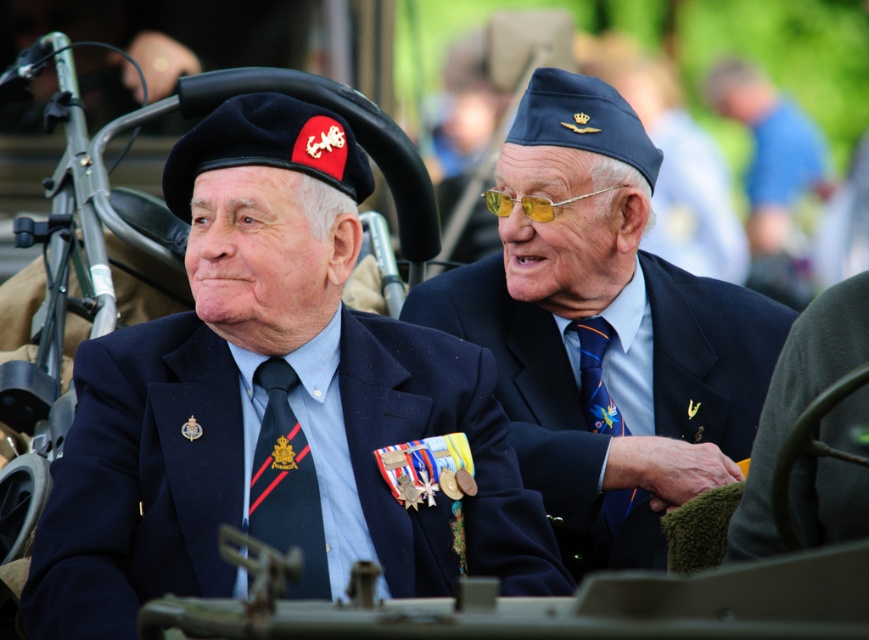
Question: Is navy blue suit at center closer to the viewer compared to blue fabric shirt at upper right?

Choices:
 (A) no
 (B) yes

Answer: (B)

Question: Is blue fabric cap at upper right bigger than multicolored silk tie at center?

Choices:
 (A) no
 (B) yes

Answer: (B)

Question: Which object appears farthest from the camera in this image?

Choices:
 (A) blue fabric cap at upper right
 (B) blue fabric shirt at upper right
 (C) navy blue suit at center

Answer: (B)

Question: Which point appears farthest from the camera in this image?

Choices:
 (A) (368, 368)
 (B) (319, 538)
 (C) (629, 493)
 (D) (707, 92)

Answer: (D)

Question: Which object is closer to the camera taking this photo?

Choices:
 (A) blue fabric shirt at upper right
 (B) multicolored silk tie at center
 (C) blue fabric cap at upper right

Answer: (C)

Question: Does blue fabric shirt at upper right have a greater width compared to black silk tie at center?

Choices:
 (A) yes
 (B) no

Answer: (A)